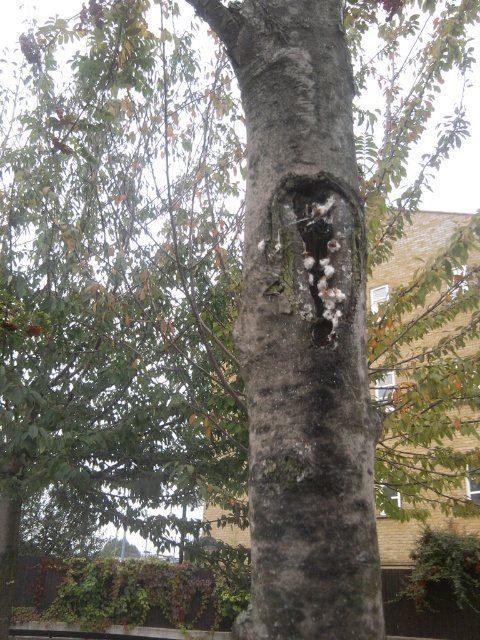
Question: Is the position of gray rough bark tree trunk at center more distant than that of white fibrous hole at center?

Choices:
 (A) no
 (B) yes

Answer: (A)

Question: Which point is closer to the camera taking this photo?

Choices:
 (A) (259, 472)
 (B) (298, 312)

Answer: (A)

Question: Is gray rough bark tree trunk at center positioned behind white fibrous hole at center?

Choices:
 (A) no
 (B) yes

Answer: (A)

Question: Does gray rough bark tree trunk at center have a greater width compared to white fibrous hole at center?

Choices:
 (A) yes
 (B) no

Answer: (A)

Question: Which object appears closest to the camera in this image?

Choices:
 (A) gray rough bark tree trunk at center
 (B) white fibrous hole at center

Answer: (A)

Question: Which object appears farthest from the camera in this image?

Choices:
 (A) gray rough bark tree trunk at center
 (B) white fibrous hole at center

Answer: (B)